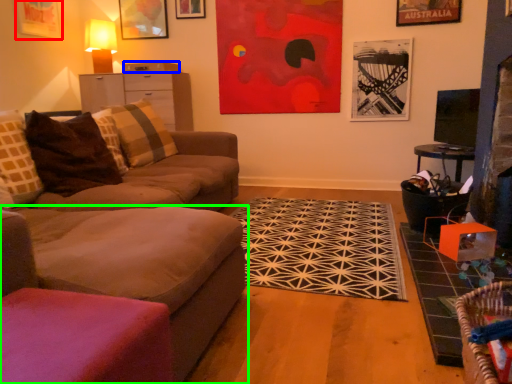
Question: Considering the real-world distances, which object is farthest from picture frame (highlighted by a red box)? drawer (highlighted by a blue box) or studio couch (highlighted by a green box)?

Choices:
 (A) drawer
 (B) studio couch

Answer: (B)